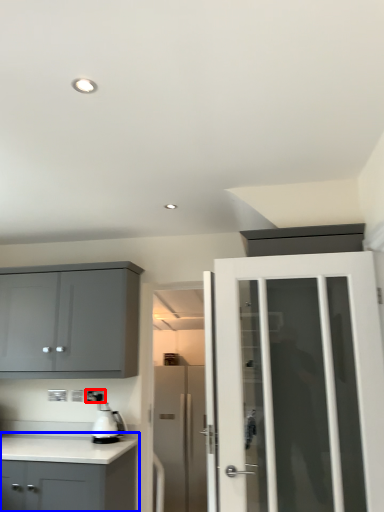
Question: Which of the following is the farthest to the observer, electric outlet (highlighted by a red box) or cabinetry (highlighted by a blue box)?

Choices:
 (A) electric outlet
 (B) cabinetry

Answer: (A)